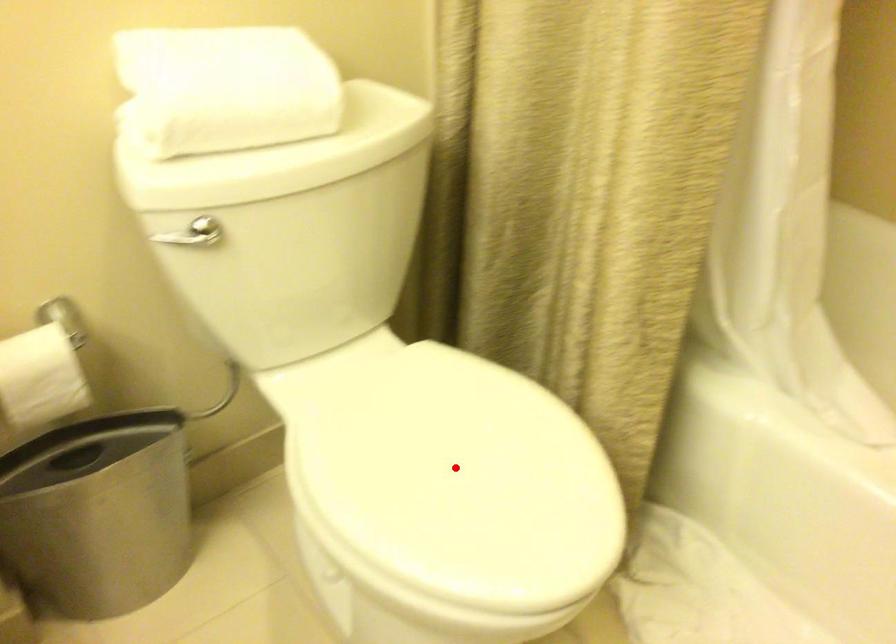
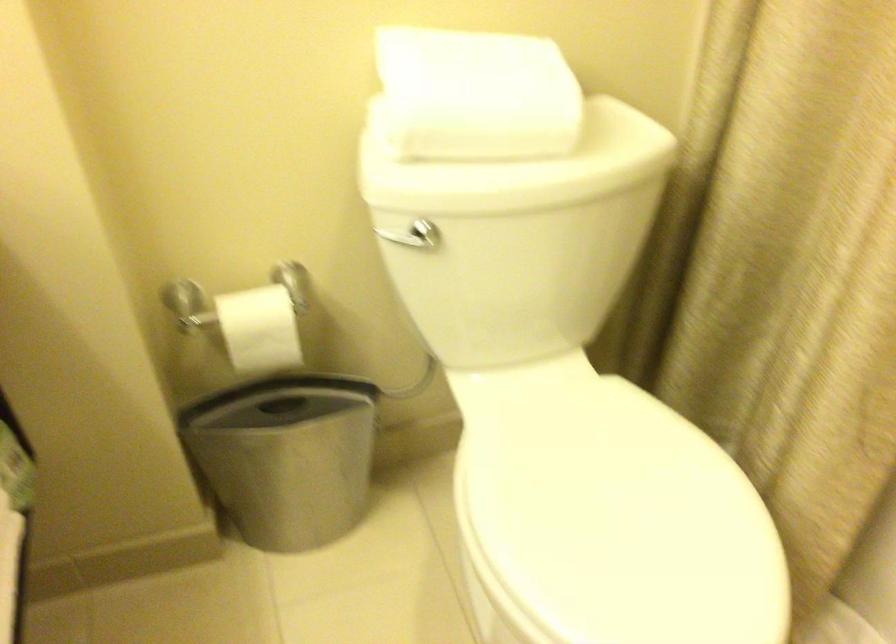
The point at the highlighted location is marked in the first image. Where is the corresponding point in the second image?

(613, 518)